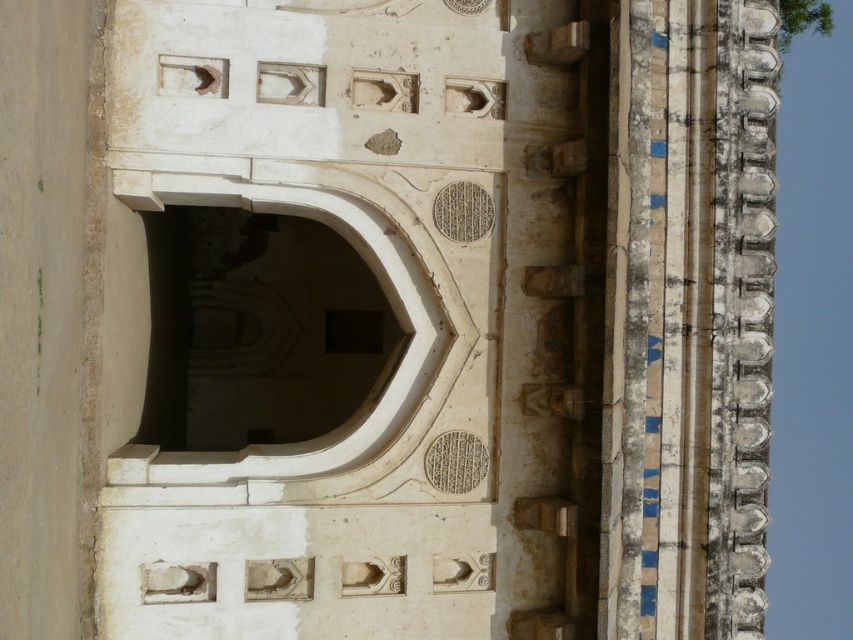
You are an architect examining a historical building. You notice the white stone arch at upper right. Where exactly is it located in the image?

The white stone arch at upper right is located at point coordinates of [688,317].

You are an architect examining the historical building. You notice two white stone arches in the structure. Which one is taller between the white stone arch at upper right and the white stone archway at center?

The white stone arch at upper right is taller than the white stone archway at center.